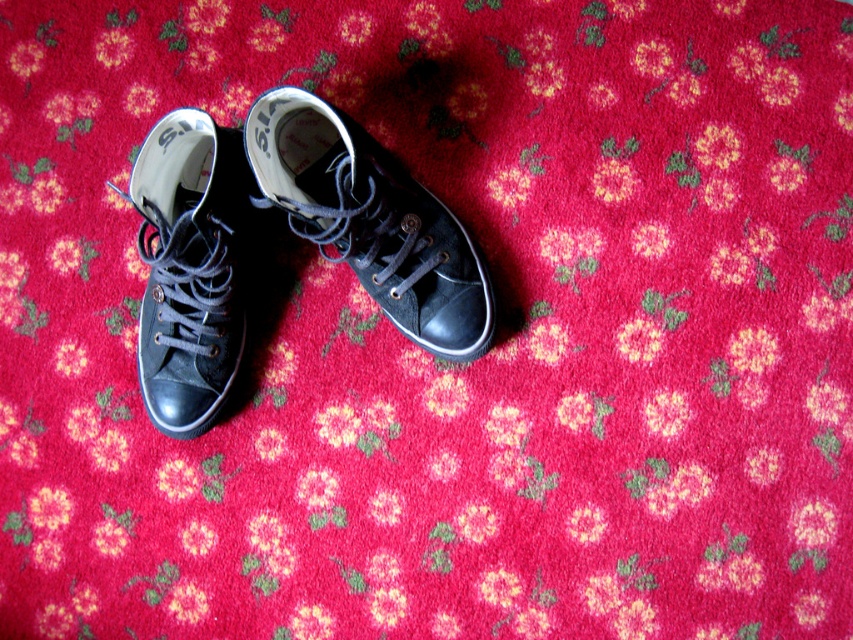
From the picture: Can you confirm if matte black sneaker at center is positioned below matte black sneaker at left?

Actually, matte black sneaker at center is above matte black sneaker at left.

Between point (438, 339) and point (161, 348), which one is positioned in front?

Point (161, 348) is in front.

Locate an element on the screen. The width and height of the screenshot is (853, 640). matte black sneaker at center is located at coordinates (370, 220).